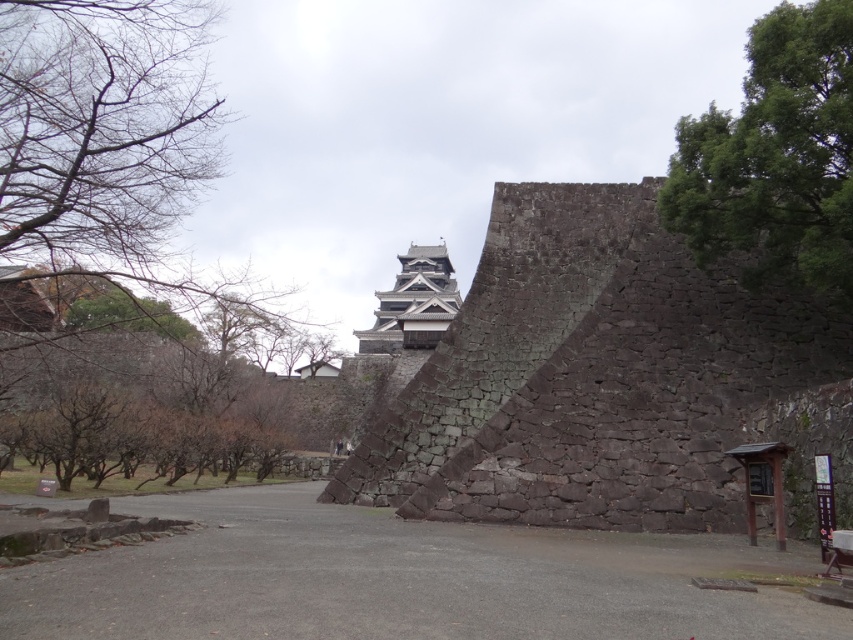
Question: Is green leafy tree at upper right wider than dark gray stone tower at center?

Choices:
 (A) no
 (B) yes

Answer: (A)

Question: Which point appears closest to the camera in this image?

Choices:
 (A) (642, 301)
 (B) (384, 326)

Answer: (A)

Question: Which point appears closest to the camera in this image?

Choices:
 (A) (434, 260)
 (B) (819, 227)

Answer: (B)

Question: Which object is positioned farthest from the green leafy tree at upper right?

Choices:
 (A) gray asphalt path at center
 (B) dark gray stone tower at center
 (C) brown leafless tree at left

Answer: (B)

Question: Considering the relative positions of dark gray stone wall at center and brown leafless tree at left in the image provided, where is dark gray stone wall at center located with respect to brown leafless tree at left?

Choices:
 (A) above
 (B) below

Answer: (A)

Question: From the image, what is the correct spatial relationship of gray asphalt path at center in relation to green leafy tree at upper right?

Choices:
 (A) right
 (B) left

Answer: (B)